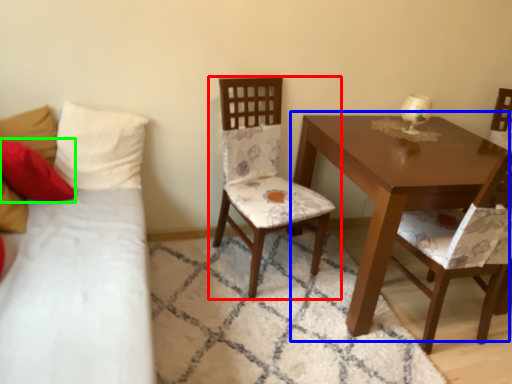
Question: Which is nearer to the chair (highlighted by a red box)? table (highlighted by a blue box) or pillow (highlighted by a green box).

Choices:
 (A) table
 (B) pillow

Answer: (A)